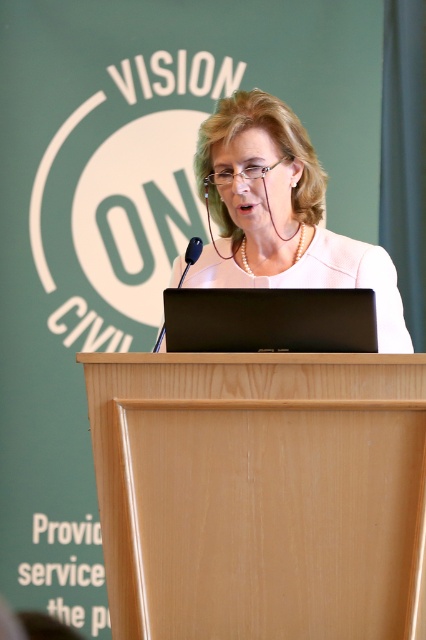
Question: Which point is farther to the camera?

Choices:
 (A) (325, 413)
 (B) (161, 326)
 (C) (201, 186)
 (D) (285, 330)

Answer: (C)

Question: Does white textured blazer at center lie in front of black matte laptop at center?

Choices:
 (A) no
 (B) yes

Answer: (A)

Question: Does light wood podium at center have a smaller size compared to white textured blazer at center?

Choices:
 (A) no
 (B) yes

Answer: (B)

Question: Estimate the real-world distances between objects in this image. Which object is closer to the white textured blazer at center?

Choices:
 (A) black matte laptop at center
 (B) light wood podium at center
 (C) black plastic microphone at center

Answer: (C)

Question: Is light wood podium at center positioned behind white textured blazer at center?

Choices:
 (A) no
 (B) yes

Answer: (A)

Question: Which of the following is the closest to the observer?

Choices:
 (A) black matte laptop at center
 (B) black plastic microphone at center
 (C) light wood podium at center
 (D) white textured blazer at center

Answer: (C)